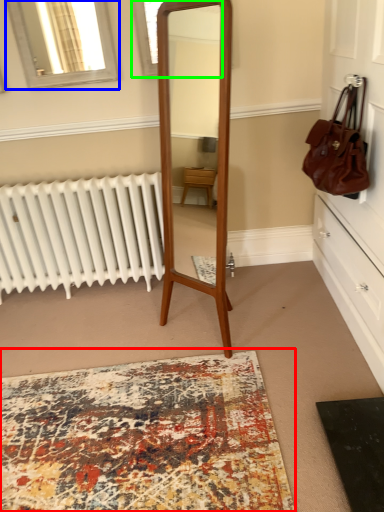
Question: Which object is the farthest from mat (highlighted by a red box)? Choose among these: window (highlighted by a blue box) or window (highlighted by a green box).

Choices:
 (A) window
 (B) window

Answer: (B)